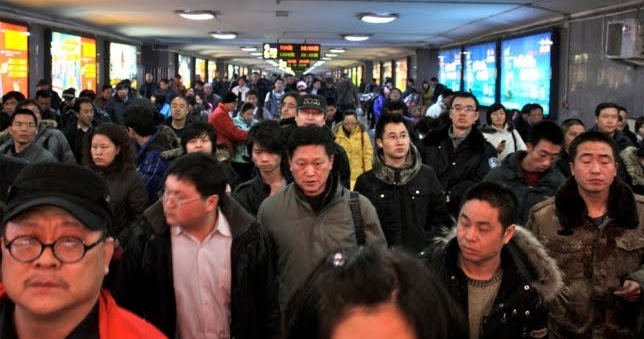
What are the coordinates of `lights` in the screenshot? It's located at (381, 13).